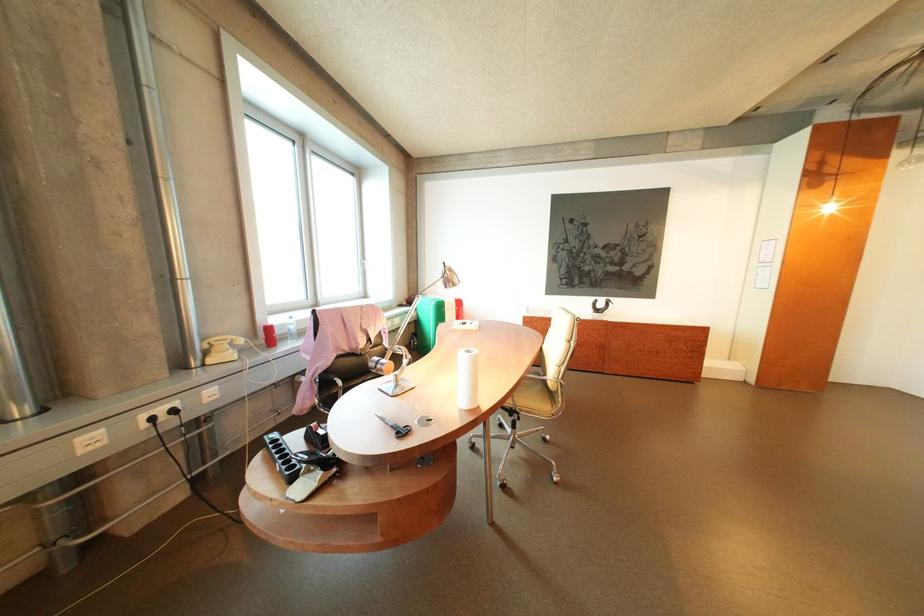
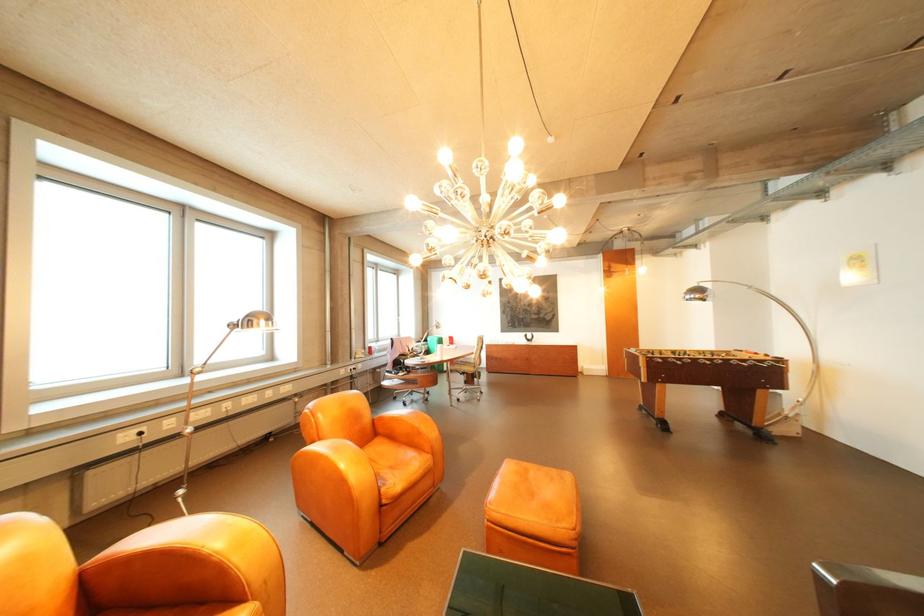
Question: In a continuous first-person perspective shot, in which direction is the camera moving?

Choices:
 (A) Left
 (B) Right
 (C) Forward
 (D) Backward

Answer: (D)